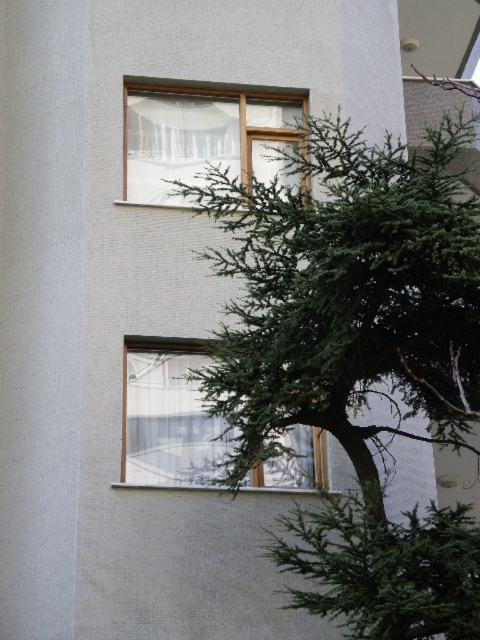
Which is below, clear glass window at center or transparent glass window at upper center?

Positioned lower is clear glass window at center.

Is point (177, 481) farther from camera compared to point (131, 154)?

That is False.

Does point (216, 454) lie in front of point (167, 179)?

Yes, it is in front of point (167, 179).

Where is `clear glass window at center`? This screenshot has width=480, height=640. clear glass window at center is located at coordinates (167, 416).

Who is positioned more to the right, green needle-like tree at lower right or clear glass window at center?

green needle-like tree at lower right is more to the right.

Find the location of `green needle-like tree at lower right`. green needle-like tree at lower right is located at coordinates (383, 568).

Where is `green needle-like tree at lower right`? green needle-like tree at lower right is located at coordinates (383, 568).

This screenshot has width=480, height=640. Find the location of `green needle-like tree at lower right`. green needle-like tree at lower right is located at coordinates (383, 568).

Is green needle-like tree at lower right below transparent glass window at upper center?

Indeed, green needle-like tree at lower right is positioned under transparent glass window at upper center.

Image resolution: width=480 pixels, height=640 pixels. What do you see at coordinates (383, 568) in the screenshot? I see `green needle-like tree at lower right` at bounding box center [383, 568].

Find the location of a particular element. This screenshot has width=480, height=640. green needle-like tree at lower right is located at coordinates (383, 568).